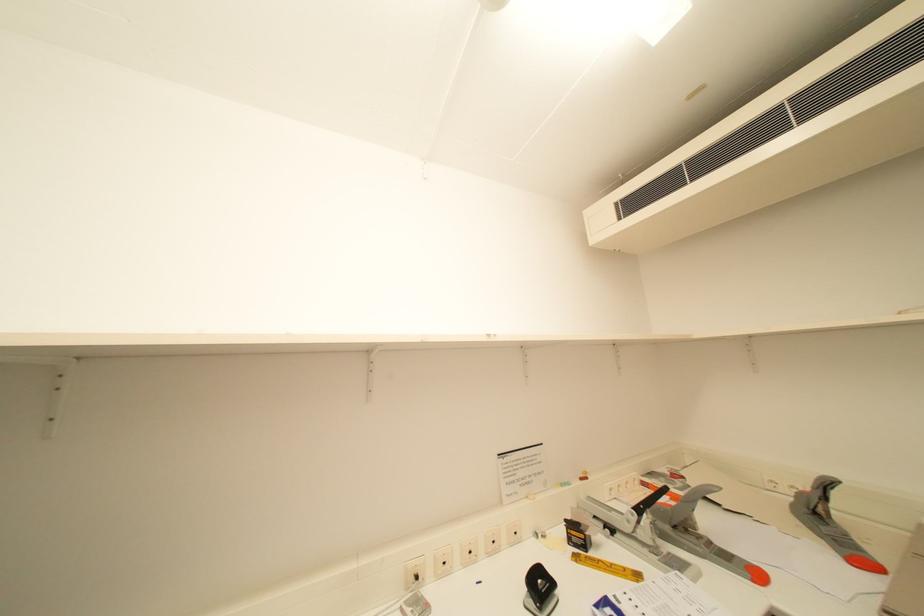
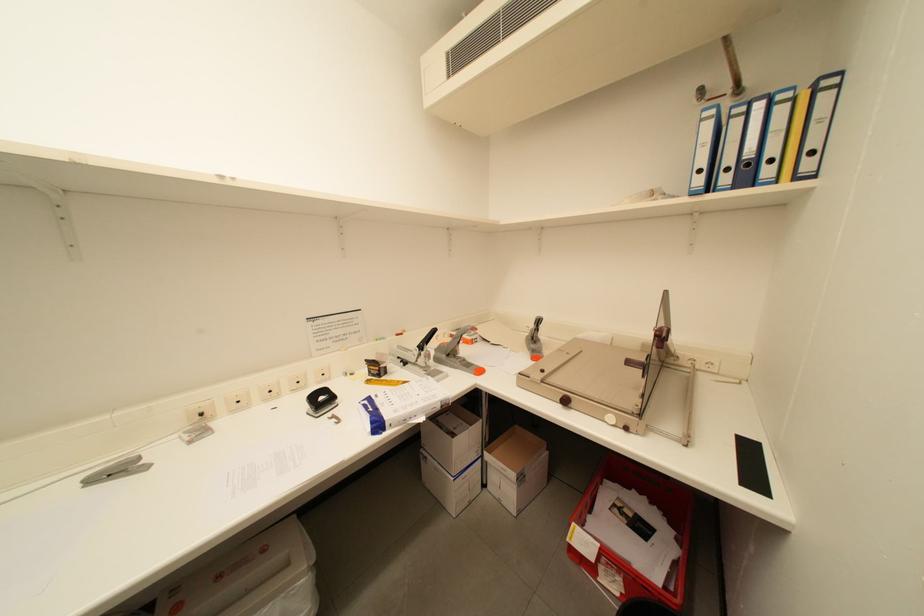
The images are taken continuously from a first-person perspective. In which direction is your viewpoint rotating?

The camera rotated toward right-down.